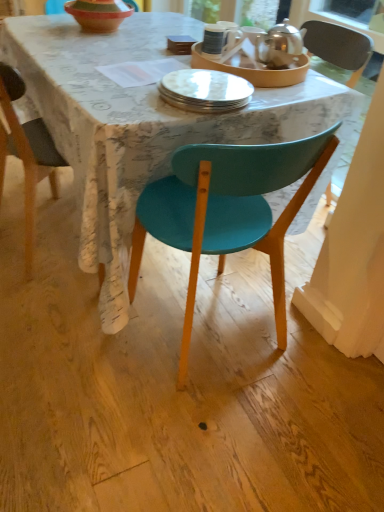
Question: Considering the positions of matte white plate at center, which ranks as the second tableware in right-to-left order, and terracotta clay bowl at upper center in the image, is matte white plate at center, which ranks as the second tableware in right-to-left order, wider or thinner than terracotta clay bowl at upper center?

Choices:
 (A) wide
 (B) thin

Answer: (A)

Question: From the image's perspective, relative to terracotta clay bowl at upper center, is matte white plate at center, which ranks as the second tableware in right-to-left order, above or below?

Choices:
 (A) above
 (B) below

Answer: (B)

Question: Considering the real-world distances, which object is farthest from the teal plastic chair at center?

Choices:
 (A) polished silver teapot at upper right, the 2th tableware in the left-to-right sequence
 (B) white glossy mug at upper center
 (C) terracotta clay bowl at upper center
 (D) matte teal chair at center
 (E) matte white plate at center, which is counted as the first tableware, starting from the left

Answer: (C)

Question: Estimate the real-world distances between objects in this image. Which object is closer to the white glossy mug at upper center?

Choices:
 (A) matte white plate at center, which ranks as the second tableware in right-to-left order
 (B) matte teal chair at center
 (C) terracotta clay bowl at upper center
 (D) teal plastic chair at center
 (E) polished silver teapot at upper right, the 2th tableware in the left-to-right sequence

Answer: (E)